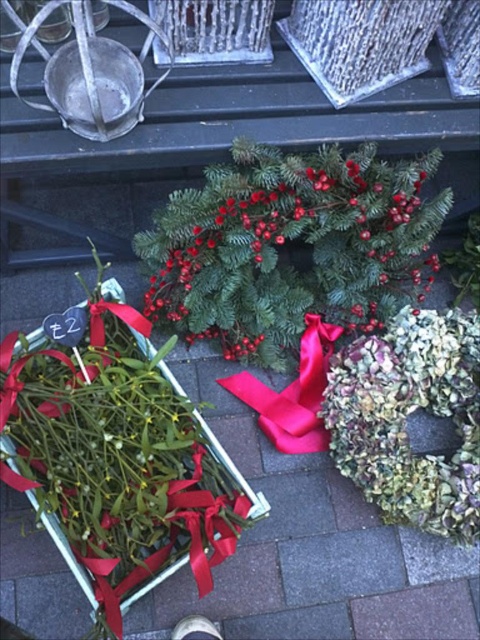
Question: Which point is farther to the camera?

Choices:
 (A) green matte wreath at center
 (B) shiny red ribbon at center

Answer: (B)

Question: Does green matte wreath at center come in front of shiny red ribbon at center?

Choices:
 (A) yes
 (B) no

Answer: (A)

Question: Is green matte wreath at center smaller than shiny red ribbon at center?

Choices:
 (A) yes
 (B) no

Answer: (B)

Question: Does green matte wreath at center lie in front of shiny red ribbon at center?

Choices:
 (A) no
 (B) yes

Answer: (B)